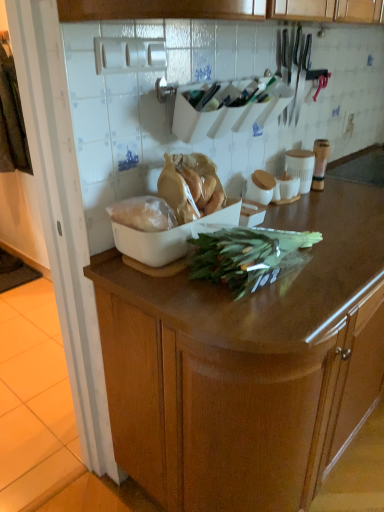
Question: Is wooden cabinet at center completely or partially outside of white plastic bag at center, which ranks as the 1th food in left-to-right order?

Choices:
 (A) no
 (B) yes

Answer: (B)

Question: Is wooden cabinet at center at the left side of white plastic bag at center, which ranks as the 1th food in left-to-right order?

Choices:
 (A) no
 (B) yes

Answer: (A)

Question: Is wooden cabinet at center further to camera compared to white plastic bag at center, which ranks as the 1th food in left-to-right order?

Choices:
 (A) yes
 (B) no

Answer: (B)

Question: Is wooden cabinet at center to the right of white plastic bag at center, which is the 2th food in right-to-left order, from the viewer's perspective?

Choices:
 (A) yes
 (B) no

Answer: (A)

Question: From the image's perspective, does wooden cabinet at center appear higher than white plastic bag at center, which ranks as the 1th food in left-to-right order?

Choices:
 (A) yes
 (B) no

Answer: (B)

Question: Does wooden cabinet at center contain white plastic bag at center, which is the 2th food in right-to-left order?

Choices:
 (A) yes
 (B) no

Answer: (B)

Question: Is the surface of green leafy at center in direct contact with white plastic bag at center, which is the 2th food in right-to-left order?

Choices:
 (A) yes
 (B) no

Answer: (B)

Question: Is green leafy at center to the left of white plastic bag at center, which ranks as the 1th food in left-to-right order, from the viewer's perspective?

Choices:
 (A) yes
 (B) no

Answer: (B)

Question: Would you say green leafy at center is outside white plastic bag at center, which is the 2th food in right-to-left order?

Choices:
 (A) no
 (B) yes

Answer: (B)

Question: From a real-world perspective, is green leafy at center under white plastic bag at center, which ranks as the 1th food in left-to-right order?

Choices:
 (A) yes
 (B) no

Answer: (A)

Question: Does green leafy at center have a larger size compared to white plastic bag at center, which is the 2th food in right-to-left order?

Choices:
 (A) no
 (B) yes

Answer: (B)

Question: From a real-world perspective, is green leafy at center over white plastic bag at center, which ranks as the 1th food in left-to-right order?

Choices:
 (A) yes
 (B) no

Answer: (B)

Question: From the image's perspective, is white plastic bag at center, which ranks as the 1th food in left-to-right order, under wooden cabinet at center?

Choices:
 (A) no
 (B) yes

Answer: (A)